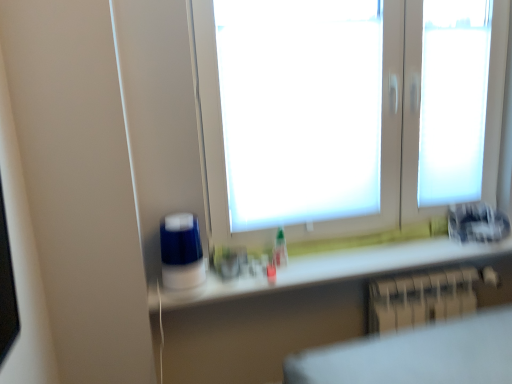
Find the location of a particular element. The height and width of the screenshot is (384, 512). metallic silver radiator at lower right is located at coordinates (420, 299).

Which is behind, metallic silver radiator at lower right or white matte window at center?

metallic silver radiator at lower right.

In the image, there is a white matte window at center. Find the location of `radiator below it (from a real-world perspective)`. radiator below it (from a real-world perspective) is located at coordinates (420, 299).

Which of these two, metallic silver radiator at lower right or white matte window at center, stands shorter?

metallic silver radiator at lower right is shorter.

From the image's perspective, is metallic silver radiator at lower right below white matte window at center?

Indeed, from the image's perspective, metallic silver radiator at lower right is shown beneath white matte window at center.

Is white glossy counter top at lower center beside white matte window at center?

They are not placed beside each other.

Considering the relative sizes of white glossy counter top at lower center and white matte window at center in the image provided, is white glossy counter top at lower center bigger than white matte window at center?

No.

From a real-world perspective, is white glossy counter top at lower center on top of white matte window at center?

No, from a real-world perspective, white glossy counter top at lower center is not over white matte window at center

Consider the image. Who is bigger, white matte window at center or white glossy counter top at lower center?

With larger size is white matte window at center.

Is white matte window at center taller or shorter than white glossy counter top at lower center?

Clearly, white matte window at center is taller compared to white glossy counter top at lower center.

Is white matte window at center in contact with white glossy counter top at lower center?

No, white matte window at center is not with white glossy counter top at lower center.

Is metallic silver radiator at lower right oriented away from white glossy counter top at lower center?

No, metallic silver radiator at lower right is not facing the opposite direction of white glossy counter top at lower center.

Is metallic silver radiator at lower right in front of or behind white glossy counter top at lower center in the image?

In the image, metallic silver radiator at lower right appears behind white glossy counter top at lower center.

From the image's perspective, is metallic silver radiator at lower right beneath white glossy counter top at lower center?

A: Yes, from the image's perspective, metallic silver radiator at lower right is beneath white glossy counter top at lower center.

Which of these two, white matte window at center or metallic silver radiator at lower right, stands shorter?

metallic silver radiator at lower right is shorter.

Is white matte window at center positioned far away from metallic silver radiator at lower right?

Actually, white matte window at center and metallic silver radiator at lower right are a little close together.

Considering the positions of point (208, 140) and point (392, 304), is point (208, 140) closer or farther from the camera than point (392, 304)?

Clearly, point (208, 140) is closer to the camera than point (392, 304).

From the image's perspective, between white matte window at center and metallic silver radiator at lower right, which one is located above?

From the image's view, white matte window at center is above.

From a real-world perspective, which object stands above the other?

From a 3D spatial view, white glossy counter top at lower center is above.

Is point (244, 291) positioned after point (471, 293)?

No, it is not.

Is metallic silver radiator at lower right located within white glossy counter top at lower center?

No, metallic silver radiator at lower right is not inside white glossy counter top at lower center.

This screenshot has height=384, width=512. Find the location of `radiator that appears below the white matte window at center (from a real-world perspective)`. radiator that appears below the white matte window at center (from a real-world perspective) is located at coordinates (420, 299).

At what (x,y) coordinates should I click in order to perform the action: click on window that is in front of the white glossy counter top at lower center. Please return your answer as a coordinate pair (x, y). This screenshot has height=384, width=512. Looking at the image, I should click on (345, 113).

Looking at the image, which one is located further to metallic silver radiator at lower right, white glossy counter top at lower center or white matte window at center?

white matte window at center is further to metallic silver radiator at lower right.

Estimate the real-world distances between objects in this image. Which object is further from white glossy counter top at lower center, metallic silver radiator at lower right or white matte window at center?

white matte window at center is further to white glossy counter top at lower center.

Based on their spatial positions, is white matte window at center or white glossy counter top at lower center further from metallic silver radiator at lower right?

white matte window at center.

Which object lies further to the anchor point white glossy counter top at lower center, white matte window at center or metallic silver radiator at lower right?

white matte window at center is positioned further to the anchor white glossy counter top at lower center.

Considering their positions, is metallic silver radiator at lower right positioned closer to white matte window at center than white glossy counter top at lower center?

white glossy counter top at lower center.

Which object lies further to the anchor point white matte window at center, white glossy counter top at lower center or metallic silver radiator at lower right?

Among the two, metallic silver radiator at lower right is located further to white matte window at center.

Image resolution: width=512 pixels, height=384 pixels. In order to click on counter top between white matte window at center and metallic silver radiator at lower right in the up-down direction in this screenshot , I will do `click(342, 269)`.